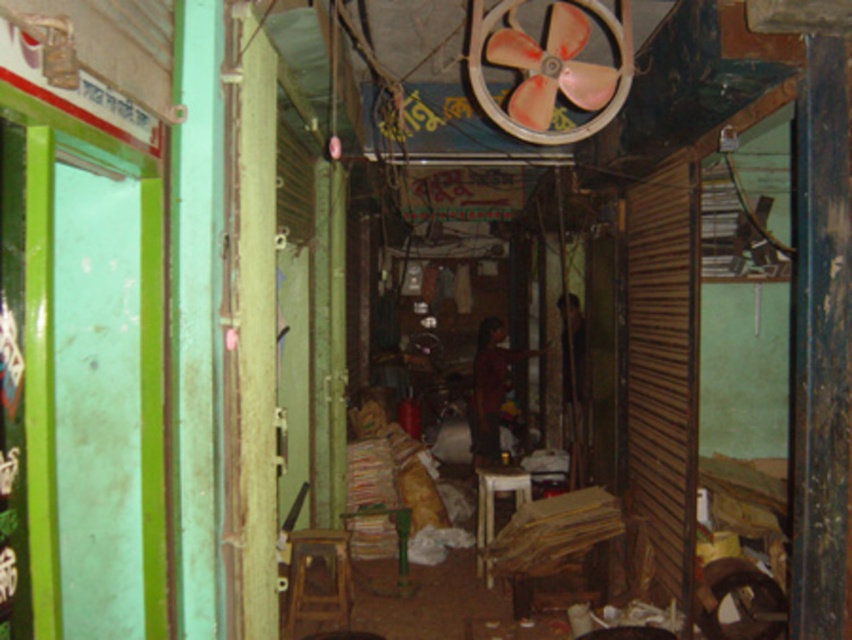
You are a delivery person trying to navigate through the narrow alleyway. There is a pink plastic fan at upper center hanging above you. Where exactly is the pink plastic fan located in terms of coordinates?

The pink plastic fan at upper center is located at coordinates point [550,67].

You are standing in the alleyway and need to move the wooden stool at center to the left side of the pink plastic fan at upper center. Is this possible given their current arrangement?

The pink plastic fan at upper center is positioned on the right side of wooden stool at center, so moving the wooden stool at center to the left side of the pink plastic fan at upper center would require shifting it further left, which is possible as long as there is enough space in the alleyway.

You are a delivery person standing at the entrance of the alley. You need to deliver a package to a point exactly 3 meters away from your current position. Can you reach the point marked as point (589, 104) without exceeding the 3 meter distance?

The distance between point (589, 104) and the camera is 3.44 meters, which is longer than 3 meters. Therefore, you cannot reach the point marked as point (589, 104) without exceeding the 3 meter distance.